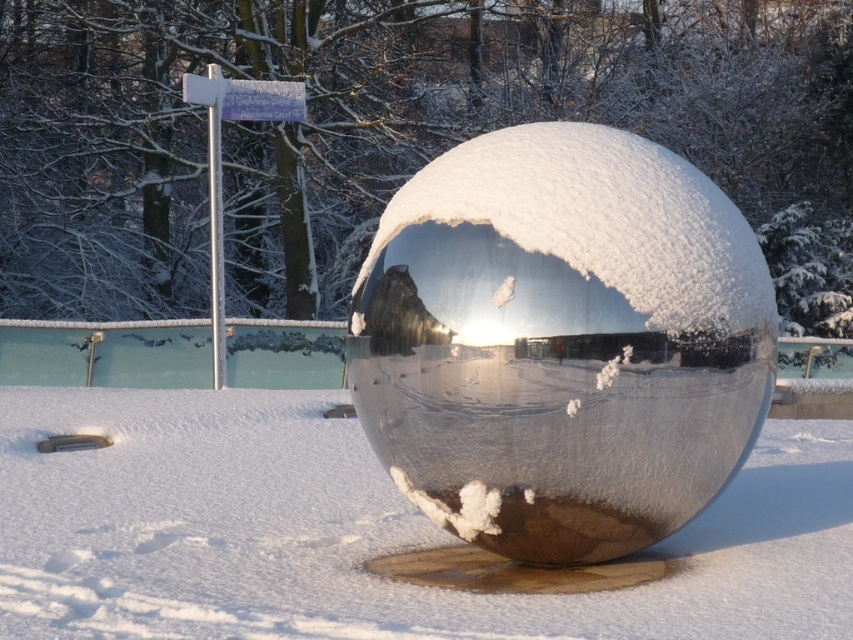
You are an artist planning to sketch the scene. You want to ensure the white fluffy snow at center is visible in the background behind the shiny metallic sphere at center. Is this possible based on the scene?

Yes, the white fluffy snow at center is behind the shiny metallic sphere at center, so it will be visible in the background when sketching the scene.

You are an artist trying to create a sculpture that fits within a narrow space. You look at the shiny metallic sphere at center and the white fluffy snow at center in the image. Which object would be easier to fit in a narrow space and why?

The shiny metallic sphere at center is thinner than the white fluffy snow at center, so it would be easier to fit in a narrow space because it has a smaller width.